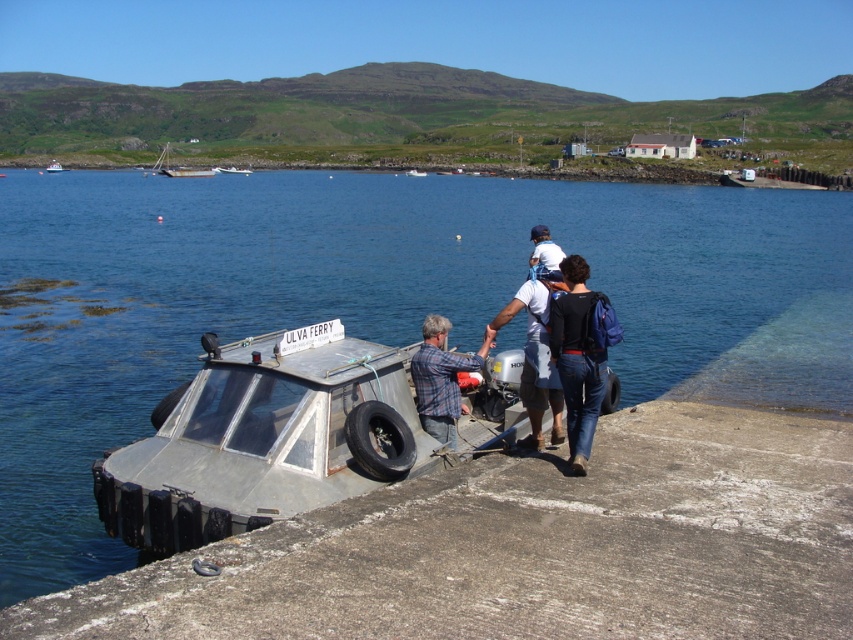
Question: Which object is farther from the camera taking this photo?

Choices:
 (A) dark blue shirt at center
 (B) white fabric shirt at center
 (C) clear blue water at center

Answer: (B)

Question: Which of the following is the closest to the observer?

Choices:
 (A) rusty metal boat at center
 (B) white wooden sailboat at upper left

Answer: (A)

Question: Estimate the real-world distances between objects in this image. Which object is farther from the black fabric backpack at center?

Choices:
 (A) metallic gray boat at center
 (B) white fabric shirt at center
 (C) dark blue shirt at center

Answer: (A)

Question: Does white wooden sailboat at upper left have a smaller size compared to metallic silver boat at center?

Choices:
 (A) no
 (B) yes

Answer: (A)

Question: Can you confirm if white wooden sailboat at upper left is thinner than metallic silver boat at center?

Choices:
 (A) no
 (B) yes

Answer: (A)

Question: Can you confirm if white fabric shirt at center is positioned below metallic gray boat at center?

Choices:
 (A) no
 (B) yes

Answer: (B)